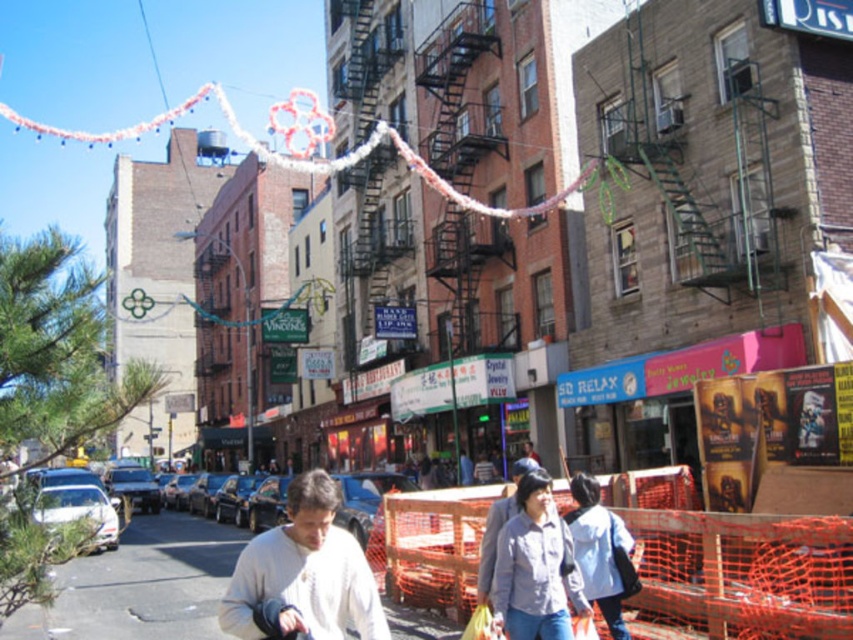
Does white matte sweater at center appear over white matte jacket at lower right?

No, white matte sweater at center is not above white matte jacket at lower right.

Image resolution: width=853 pixels, height=640 pixels. Identify the location of white matte sweater at center. (305, 572).

Looking at this image, can you confirm if white matte sweater at center is shorter than light gray shirt at center?

No.

Identify the location of white matte sweater at center. The width and height of the screenshot is (853, 640). (305, 572).

Between point (753, 120) and point (335, 573), which one is positioned in front?

Point (335, 573) is more forward.

Is green metal fire escape at upper right wider than white matte sweater at center?

Incorrect, green metal fire escape at upper right's width does not surpass white matte sweater at center's.

Who is more distant from viewer, (x=680, y=134) or (x=335, y=550)?

Positioned behind is point (x=680, y=134).

You are a GUI agent. You are given a task and a screenshot of the screen. Output one action in this format:
    pyautogui.click(x=<x>, y=<y>)
    Task: Click on the green metal fire escape at upper right
    This screenshot has height=640, width=853.
    Given the screenshot: What is the action you would take?
    pyautogui.click(x=694, y=140)